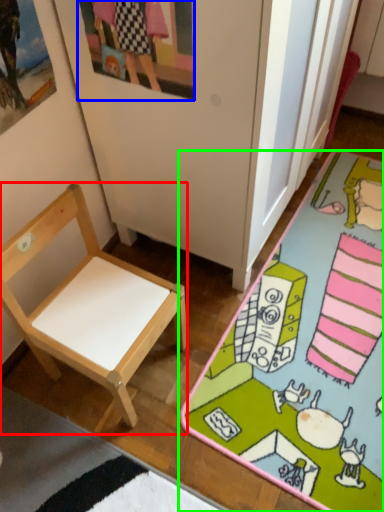
Question: Estimate the real-world distances between objects in this image. Which object is farther from chair (highlighted by a red box), picture frame (highlighted by a blue box) or desk (highlighted by a green box)?

Choices:
 (A) picture frame
 (B) desk

Answer: (A)